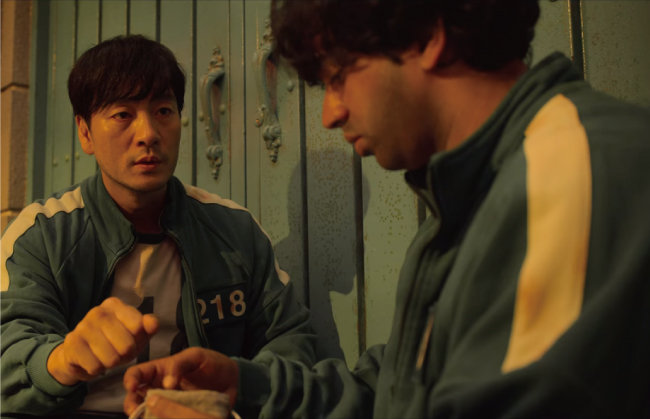
What are the coordinates of `handles` in the screenshot? It's located at 212,92, 260,83.